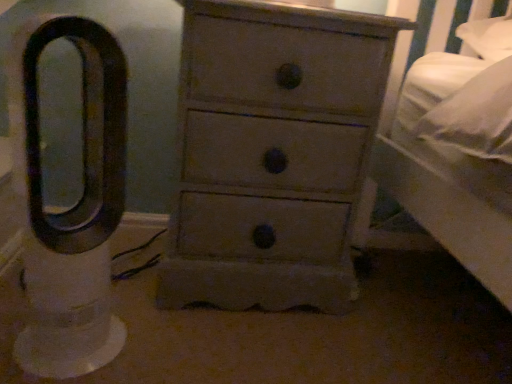
Question: Is white plastic fan at left oriented towards matte gray chest of drawers at center?

Choices:
 (A) no
 (B) yes

Answer: (A)

Question: Would you say matte gray chest of drawers at center is part of white plastic fan at left's contents?

Choices:
 (A) yes
 (B) no

Answer: (B)

Question: Considering the relative sizes of white plastic fan at left and matte gray chest of drawers at center in the image provided, is white plastic fan at left taller than matte gray chest of drawers at center?

Choices:
 (A) yes
 (B) no

Answer: (B)

Question: Is white plastic fan at left positioned beyond the bounds of matte gray chest of drawers at center?

Choices:
 (A) no
 (B) yes

Answer: (B)

Question: Considering the relative sizes of white plastic fan at left and matte gray chest of drawers at center in the image provided, is white plastic fan at left bigger than matte gray chest of drawers at center?

Choices:
 (A) no
 (B) yes

Answer: (A)

Question: Is white plastic fan at left further to the viewer compared to matte gray chest of drawers at center?

Choices:
 (A) no
 (B) yes

Answer: (A)

Question: Would you say matte gray chest of drawers at center contains white plastic fan at left?

Choices:
 (A) no
 (B) yes

Answer: (A)

Question: Is matte gray chest of drawers at center to the right of white plastic fan at left from the viewer's perspective?

Choices:
 (A) no
 (B) yes

Answer: (B)

Question: Is matte gray chest of drawers at center to the left of white plastic fan at left from the viewer's perspective?

Choices:
 (A) no
 (B) yes

Answer: (A)

Question: Does matte gray chest of drawers at center have a greater height compared to white plastic fan at left?

Choices:
 (A) no
 (B) yes

Answer: (B)

Question: Is matte gray chest of drawers at center positioned with its back to white plastic fan at left?

Choices:
 (A) yes
 (B) no

Answer: (B)

Question: Is the depth of matte gray chest of drawers at center less than that of white plastic fan at left?

Choices:
 (A) yes
 (B) no

Answer: (B)

Question: From a real-world perspective, is matte gray chest of drawers at center above or below white plastic fan at left?

Choices:
 (A) below
 (B) above

Answer: (B)